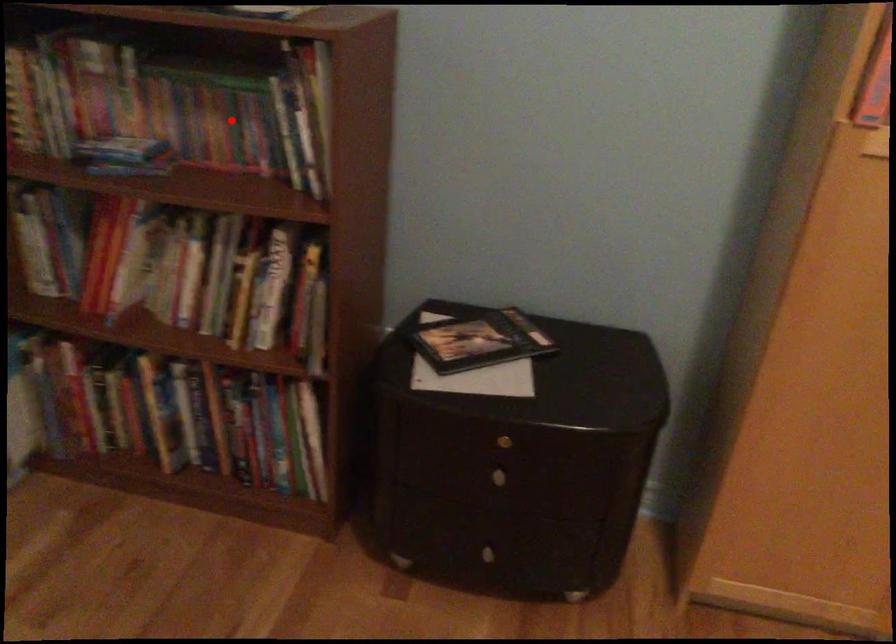
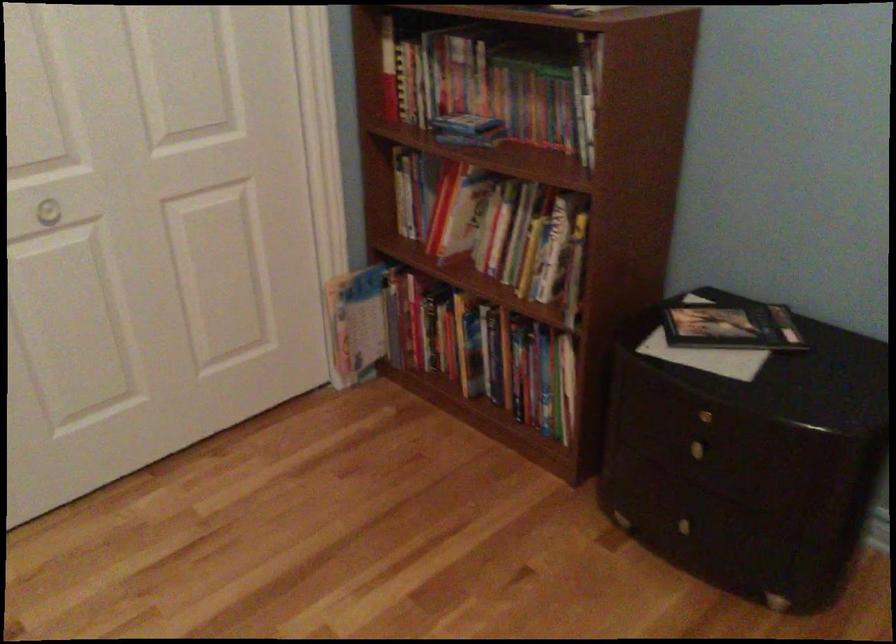
Question: A red point is marked in image1. In image2, is the corresponding 3D point closer to the camera or farther? Reply with the corresponding letter.

Choices:
 (A) The corresponding 3D point is closer.
 (B) The corresponding 3D point is farther.

Answer: (B)